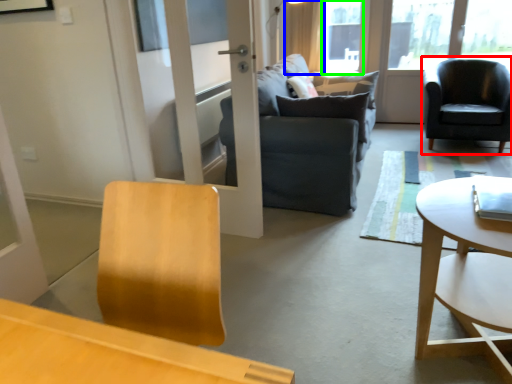
Question: Estimate the real-world distances between objects in this image. Which object is closer to chair (highlighted by a red box), curtain (highlighted by a blue box) or window screen (highlighted by a green box)?

Choices:
 (A) curtain
 (B) window screen

Answer: (B)